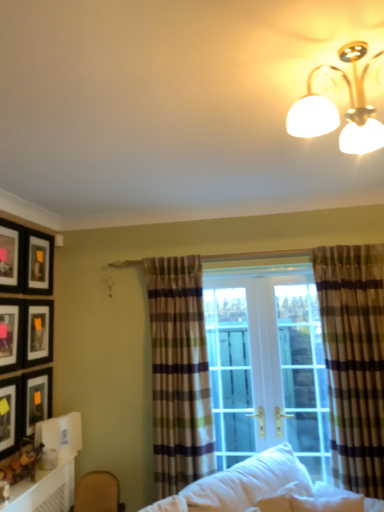
What do you see at coordinates (9, 336) in the screenshot?
I see `metallic silver picture frame at left, arranged as the fourth picture frame when ordered from the bottom` at bounding box center [9, 336].

The width and height of the screenshot is (384, 512). Describe the element at coordinates (39, 263) in the screenshot. I see `matte black picture frame at upper left, which appears as the second picture frame when viewed from the top` at that location.

I want to click on gold metallic light fixture at upper right, so click(337, 109).

What do you see at coordinates (337, 109) in the screenshot?
I see `gold metallic light fixture at upper right` at bounding box center [337, 109].

The height and width of the screenshot is (512, 384). Describe the element at coordinates (179, 374) in the screenshot. I see `plaid fabric curtain at center, which appears as the 2th curtain when viewed from the right` at that location.

The width and height of the screenshot is (384, 512). What do you see at coordinates (36, 398) in the screenshot? I see `matte black picture frame at lower left, acting as the 6th picture frame starting from the top` at bounding box center [36, 398].

I want to click on matte black picture frame at left, the second picture frame positioned from the bottom, so click(7, 419).

Between white glossy table at lower left and matte black picture frame at upper left, placed as the fifth picture frame when sorted from bottom to top, which one has more height?

Standing taller between the two is matte black picture frame at upper left, placed as the fifth picture frame when sorted from bottom to top.

From the image's perspective, does white glossy table at lower left appear higher than matte black picture frame at upper left, placed as the fifth picture frame when sorted from bottom to top?

No, from the image's perspective, white glossy table at lower left is not on top of matte black picture frame at upper left, placed as the fifth picture frame when sorted from bottom to top.

Is white glossy table at lower left to the right of matte black picture frame at upper left, placed as the fifth picture frame when sorted from bottom to top, from the viewer's perspective?

Yes, white glossy table at lower left is to the right of matte black picture frame at upper left, placed as the fifth picture frame when sorted from bottom to top.

Which is correct: white glossy table at lower left is inside matte black picture frame at upper left, which appears as the second picture frame when viewed from the top, or outside of it?

white glossy table at lower left is spatially situated outside matte black picture frame at upper left, which appears as the second picture frame when viewed from the top.

Based on the photo, is matte black picture frame at left, the second picture frame positioned from the bottom, situated inside matte black picture frame at upper left, arranged as the 6th picture frame when ordered from the bottom, or outside?

The correct answer is: outside.

Is matte black picture frame at left, placed as the fifth picture frame when sorted from top to bottom, looking in the opposite direction of matte black picture frame at upper left, which ranks as the 1th picture frame in top-to-bottom order?

That's not correct — matte black picture frame at left, placed as the fifth picture frame when sorted from top to bottom, is not looking away from matte black picture frame at upper left, which ranks as the 1th picture frame in top-to-bottom order.

Which object is positioned more to the right, matte black picture frame at left, the second picture frame positioned from the bottom, or matte black picture frame at upper left, which ranks as the 1th picture frame in top-to-bottom order?

Positioned to the right is matte black picture frame at left, the second picture frame positioned from the bottom.

Between matte black picture frame at left, placed as the fifth picture frame when sorted from top to bottom, and matte black picture frame at upper left, which ranks as the 1th picture frame in top-to-bottom order, which one has larger size?

matte black picture frame at left, placed as the fifth picture frame when sorted from top to bottom, is bigger.

Can you confirm if plaid fabric curtain at center, which appears as the 2th curtain when viewed from the right, is taller than white soft studio couch at lower center?

Correct, plaid fabric curtain at center, which appears as the 2th curtain when viewed from the right, is much taller as white soft studio couch at lower center.

Could you tell me if plaid fabric curtain at center, the first curtain positioned from the left, is turned towards white soft studio couch at lower center?

No, plaid fabric curtain at center, the first curtain positioned from the left, is not oriented towards white soft studio couch at lower center.

From a real-world perspective, is plaid fabric curtain at center, which appears as the 2th curtain when viewed from the right, beneath white soft studio couch at lower center?

No, from a real-world perspective, plaid fabric curtain at center, which appears as the 2th curtain when viewed from the right, is not below white soft studio couch at lower center.

From a real-world perspective, between white soft studio couch at lower center and gold metallic light fixture at upper right, who is vertically lower?

white soft studio couch at lower center, from a real-world perspective.

Based on the photo, is white soft studio couch at lower center with gold metallic light fixture at upper right?

white soft studio couch at lower center and gold metallic light fixture at upper right are not in contact.

Would you say white soft studio couch at lower center is outside gold metallic light fixture at upper right?

Indeed, white soft studio couch at lower center is completely outside gold metallic light fixture at upper right.

From the image's perspective, between white soft studio couch at lower center and gold metallic light fixture at upper right, who is located below?

white soft studio couch at lower center, from the image's perspective.

From a real-world perspective, which curtain is the 2nd one above the white soft pillow at lower center? Please provide its 2D coordinates.

[(179, 374)]

Is plaid fabric curtain at center, which appears as the 2th curtain when viewed from the right, not within white soft pillow at lower center?

Indeed, plaid fabric curtain at center, which appears as the 2th curtain when viewed from the right, is completely outside white soft pillow at lower center.

Is plaid fabric curtain at center, which appears as the 2th curtain when viewed from the right, thinner than white soft pillow at lower center?

Yes, plaid fabric curtain at center, which appears as the 2th curtain when viewed from the right, is thinner than white soft pillow at lower center.

Measure the distance from white soft pillow at lower center to plaid fabric curtain at center, which appears as the 2th curtain when viewed from the right.

white soft pillow at lower center is 35.60 inches from plaid fabric curtain at center, which appears as the 2th curtain when viewed from the right.

Which of these two, white soft pillow at lower center or plaid fabric curtain at center, the first curtain positioned from the left, is wider?

With larger width is white soft pillow at lower center.

Is white soft pillow at lower center closer to camera compared to plaid fabric curtain at center, the first curtain positioned from the left?

That is True.

Considering the sizes of objects white soft pillow at lower center and plaid fabric curtain at center, the first curtain positioned from the left, in the image provided, who is shorter, white soft pillow at lower center or plaid fabric curtain at center, the first curtain positioned from the left,?

white soft pillow at lower center is shorter.

Is white glossy table at lower left inside or outside of matte black picture frame at left, the second picture frame positioned from the bottom?

white glossy table at lower left is outside matte black picture frame at left, the second picture frame positioned from the bottom.

Measure the distance between white glossy table at lower left and matte black picture frame at left, the second picture frame positioned from the bottom.

15.46 inches.

Is white glossy table at lower left positioned before matte black picture frame at left, the second picture frame positioned from the bottom?

Yes.

Between white glossy table at lower left and matte black picture frame at left, placed as the fifth picture frame when sorted from top to bottom, which one appears on the left side from the viewer's perspective?

matte black picture frame at left, placed as the fifth picture frame when sorted from top to bottom.

Where is `the 5th picture frame above the white glossy table at lower left (from a real-world perspective)`? the 5th picture frame above the white glossy table at lower left (from a real-world perspective) is located at coordinates (39, 263).

You are a GUI agent. You are given a task and a screenshot of the screen. Output one action in this format:
    pyautogui.click(x=<x>, y=<y>)
    Task: Click on the 2nd picture frame to the left of the matte black picture frame at left, the second picture frame positioned from the bottom, starting your count from the anchor
    
    Given the screenshot: What is the action you would take?
    pyautogui.click(x=11, y=256)

Looking at the image, which one is located closer to white soft pillow at lower center, plaid fabric curtain at center, which appears as the 2th curtain when viewed from the right, or metallic silver picture frame at left, arranged as the fourth picture frame when ordered from the bottom?

Based on the image, plaid fabric curtain at center, which appears as the 2th curtain when viewed from the right, appears to be nearer to white soft pillow at lower center.

Looking at the image, which one is located further to plaid fabric curtain at center, which appears as the 2th curtain when viewed from the right, metallic silver picture frame at left, which is counted as the 3th picture frame, starting from the top, or matte black picture frame at upper left, which appears as the second picture frame when viewed from the top?

metallic silver picture frame at left, which is counted as the 3th picture frame, starting from the top, is further to plaid fabric curtain at center, which appears as the 2th curtain when viewed from the right.

From the image, which object appears to be nearer to gold metallic light fixture at upper right, plaid fabric curtain at center, which appears as the 2th curtain when viewed from the right, or matte black picture frame at left, the second picture frame positioned from the bottom?

Among the two, plaid fabric curtain at center, which appears as the 2th curtain when viewed from the right, is located nearer to gold metallic light fixture at upper right.

From the image, which object appears to be farther from matte black picture frame at lower left, acting as the 1th picture frame starting from the bottom, matte black picture frame at upper left, which ranks as the 1th picture frame in top-to-bottom order, or matte black picture frame at left, which is the 4th picture frame in top-to-bottom order?

Based on the image, matte black picture frame at upper left, which ranks as the 1th picture frame in top-to-bottom order, appears to be further to matte black picture frame at lower left, acting as the 1th picture frame starting from the bottom.

From the picture: Estimate the real-world distances between objects in this image. Which object is further from gold metallic light fixture at upper right, matte black picture frame at left, placed as the fifth picture frame when sorted from top to bottom, or metallic silver picture frame at left, which is counted as the 3th picture frame, starting from the top?

matte black picture frame at left, placed as the fifth picture frame when sorted from top to bottom.

Which object lies further to the anchor point matte black picture frame at lower left, acting as the 1th picture frame starting from the bottom, white soft studio couch at lower center or metallic silver picture frame at left, which is counted as the 3th picture frame, starting from the top?

Among the two, white soft studio couch at lower center is located further to matte black picture frame at lower left, acting as the 1th picture frame starting from the bottom.

In the scene shown: Based on their spatial positions, is white glossy table at lower left or matte black picture frame at upper left, which appears as the second picture frame when viewed from the top, closer to metallic silver picture frame at left, arranged as the fourth picture frame when ordered from the bottom?

matte black picture frame at upper left, which appears as the second picture frame when viewed from the top, lies closer to metallic silver picture frame at left, arranged as the fourth picture frame when ordered from the bottom, than the other object.

Based on the photo, considering their positions, is matte black picture frame at lower left, acting as the 1th picture frame starting from the bottom, positioned further to matte black picture frame at upper left, which appears as the second picture frame when viewed from the top, than plaid fabric curtain at right, the second curtain from the left?

plaid fabric curtain at right, the second curtain from the left, is further to matte black picture frame at upper left, which appears as the second picture frame when viewed from the top.

Where is `pillow situated between white glossy table at lower left and plaid fabric curtain at right, the first curtain from the right, from left to right`? pillow situated between white glossy table at lower left and plaid fabric curtain at right, the first curtain from the right, from left to right is located at coordinates (282, 498).

In order to click on studio couch between matte black picture frame at left, the second picture frame positioned from the bottom, and plaid fabric curtain at right, the second curtain from the left in this screenshot , I will do `click(259, 488)`.

Find the location of a particular element. The image size is (384, 512). lamp between matte black picture frame at upper left, which appears as the second picture frame when viewed from the top, and plaid fabric curtain at right, the second curtain from the left, in the horizontal direction is located at coordinates (337, 109).

Find the location of a particular element. The width and height of the screenshot is (384, 512). studio couch between gold metallic light fixture at upper right and matte black picture frame at upper left, placed as the fifth picture frame when sorted from bottom to top, in the front-back direction is located at coordinates (259, 488).